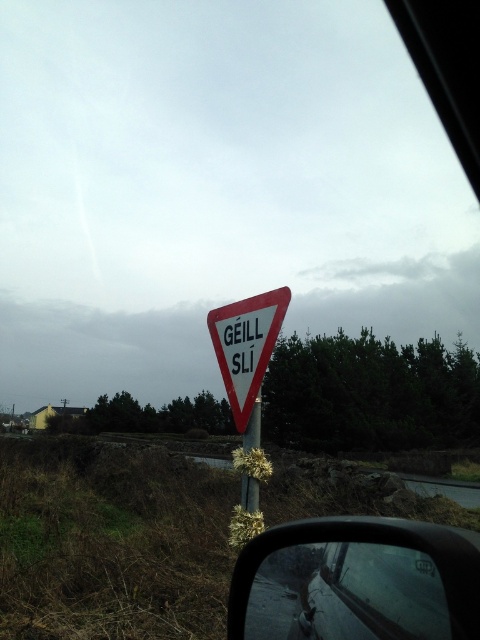
Question: Is white plastic triangle at center to the right of metallic pole at center from the viewer's perspective?

Choices:
 (A) no
 (B) yes

Answer: (A)

Question: Which point appears farthest from the camera in this image?

Choices:
 (A) (240, 333)
 (B) (243, 496)

Answer: (A)

Question: Can you confirm if black plastic side mirror at lower right is smaller than white plastic triangle at center?

Choices:
 (A) yes
 (B) no

Answer: (A)

Question: Considering the real-world distances, which object is closest to the black plastic side mirror at lower right?

Choices:
 (A) white plastic triangle at center
 (B) metallic pole at center

Answer: (B)

Question: Based on their relative distances, which object is nearer to the white plastic triangle at center?

Choices:
 (A) black plastic side mirror at lower right
 (B) metallic pole at center

Answer: (B)

Question: Is white plastic triangle at center above metallic pole at center?

Choices:
 (A) yes
 (B) no

Answer: (A)